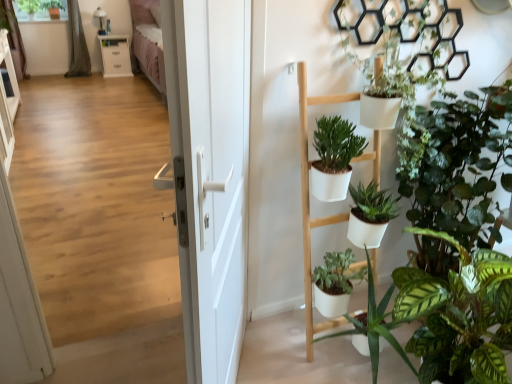
Question: Is white glossy cabinet at upper left facing away from wooden floor at center?

Choices:
 (A) no
 (B) yes

Answer: (A)

Question: Can you confirm if white glossy cabinet at upper left is wider than wooden floor at center?

Choices:
 (A) no
 (B) yes

Answer: (B)

Question: Does white glossy cabinet at upper left lie in front of wooden floor at center?

Choices:
 (A) yes
 (B) no

Answer: (B)

Question: Is white glossy cabinet at upper left not inside wooden floor at center?

Choices:
 (A) no
 (B) yes

Answer: (B)

Question: Considering the relative sizes of white glossy cabinet at upper left and wooden floor at center in the image provided, is white glossy cabinet at upper left smaller than wooden floor at center?

Choices:
 (A) yes
 (B) no

Answer: (B)

Question: Considering the positions of green fabric curtain at upper left, placed as the second curtain when sorted from right to left, and gray fabric curtain at upper left, the 2th curtain from the left, in the image, is green fabric curtain at upper left, placed as the second curtain when sorted from right to left, wider or thinner than gray fabric curtain at upper left, the 2th curtain from the left,?

Choices:
 (A) wide
 (B) thin

Answer: (B)

Question: From their relative heights in the image, would you say green fabric curtain at upper left, placed as the second curtain when sorted from right to left, is taller or shorter than gray fabric curtain at upper left, the 2th curtain from the left?

Choices:
 (A) tall
 (B) short

Answer: (B)

Question: Considering the positions of green fabric curtain at upper left, placed as the second curtain when sorted from right to left, and gray fabric curtain at upper left, the 2th curtain from the left, in the image, is green fabric curtain at upper left, placed as the second curtain when sorted from right to left, bigger or smaller than gray fabric curtain at upper left, the 2th curtain from the left,?

Choices:
 (A) big
 (B) small

Answer: (B)

Question: Is point (8, 36) positioned closer to the camera than point (74, 13)?

Choices:
 (A) farther
 (B) closer

Answer: (B)

Question: Which is correct: green fabric curtain at upper left, placed as the second curtain when sorted from right to left, is inside green matte plant at upper left, the 2th plant in the right-to-left sequence, or outside of it?

Choices:
 (A) inside
 (B) outside

Answer: (B)

Question: From a real-world perspective, is green fabric curtain at upper left, placed as the second curtain when sorted from right to left, physically located above or below green matte plant at upper left, the 2th plant in the right-to-left sequence?

Choices:
 (A) above
 (B) below

Answer: (B)

Question: Is green fabric curtain at upper left, placed as the second curtain when sorted from right to left, wider or thinner than green matte plant at upper left, arranged as the first plant when viewed from the left?

Choices:
 (A) thin
 (B) wide

Answer: (A)

Question: Considering the positions of point (7, 24) and point (23, 1), is point (7, 24) closer or farther from the camera than point (23, 1)?

Choices:
 (A) farther
 (B) closer

Answer: (B)

Question: Does point [71, 64] appear closer or farther from the camera than point [31, 13]?

Choices:
 (A) closer
 (B) farther

Answer: (B)

Question: In the image, is gray fabric curtain at upper left, the 2th curtain from the left, positioned in front of or behind green matte plant at upper left, the 2th plant in the right-to-left sequence?

Choices:
 (A) front
 (B) behind

Answer: (A)